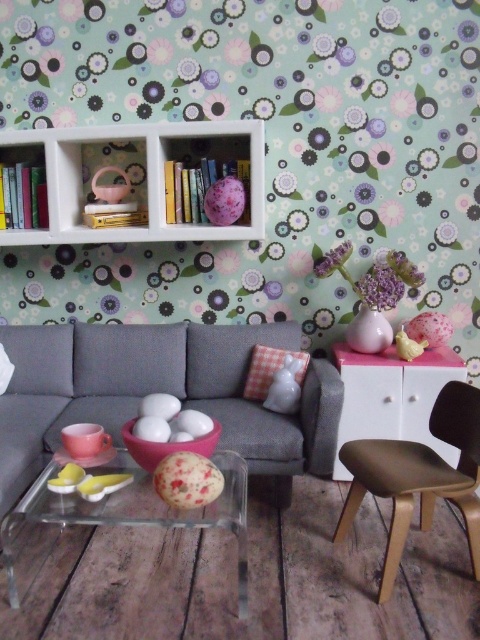
You are standing in the living room and want to place a small plant on the coffee table. The plant requires at least 2 meters of space from the viewer to ensure it is visible. Is the point on the coffee table at coordinates point (130,211) far enough for the plant?

The distance of point (130,211) from viewer is 2.79 meters, which is more than the required 2 meters. Therefore, placing the plant at point (130,211) will ensure it is visible.

You are arranging a new plant in the living room and need to place it between the white matte bookshelf at upper center and the matte pink plastic basket at upper left. Which side of the bookshelf should you place the plant to ensure it is between both objects?

You should place the plant to the left side of the white matte bookshelf at upper center since it is positioned to the right of the matte pink plastic basket at upper left, making the left side of the bookshelf adjacent to the basket.

You are an interior designer planning to place a tall floor lamp in this living room. Given the space where the white matte bookshelf at upper center and the matte pink plastic basket at upper left are located, which object would be more suitable to place the lamp next to and why?

The white matte bookshelf at upper center is much taller than the matte pink plastic basket at upper left, so placing the tall floor lamp next to the white matte bookshelf at upper center would create a balanced and visually harmonious arrangement.